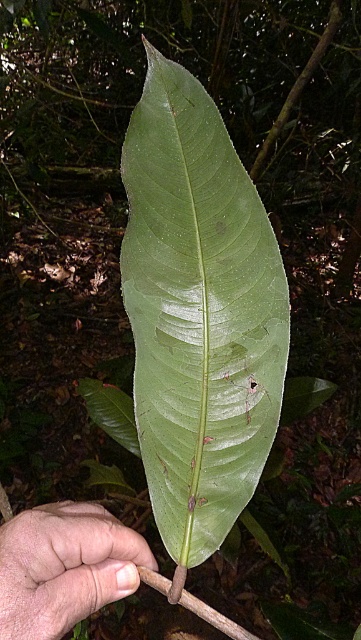
The image size is (361, 640). Describe the element at coordinates (198, 312) in the screenshot. I see `green smooth leaf at center` at that location.

Does green smooth leaf at center lie in front of skinny flesh at lower left?

Yes, it is in front of skinny flesh at lower left.

Is point (205, 339) positioned after point (114, 538)?

No.

Image resolution: width=361 pixels, height=640 pixels. Find the location of `green smooth leaf at center`. green smooth leaf at center is located at coordinates (198, 312).